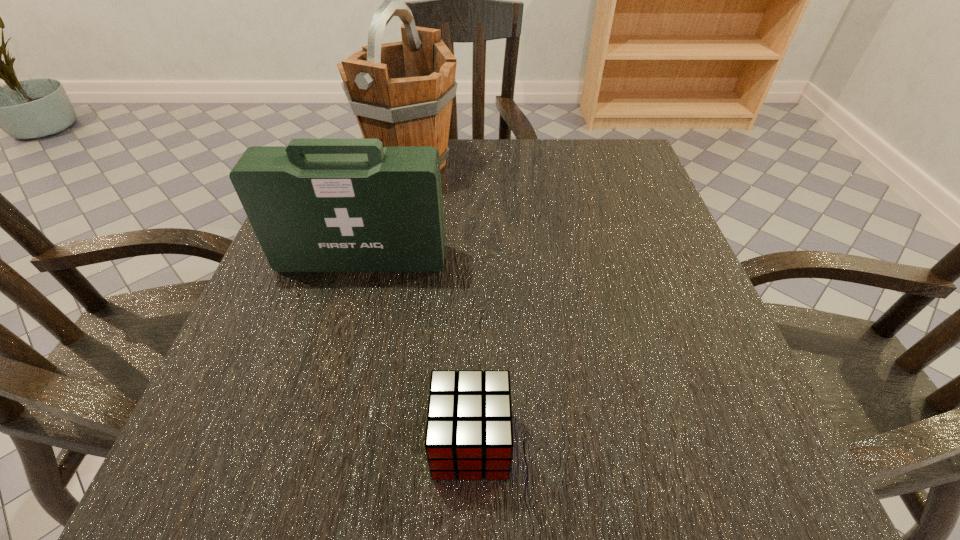
The width and height of the screenshot is (960, 540). Identify the location of free space between the farthest object and the nearest object. (441, 303).

Locate an element on the screen. The height and width of the screenshot is (540, 960). free space between the bucket and the shortest object is located at coordinates (441, 303).

This screenshot has width=960, height=540. Identify the location of free space between the bucket and the cube. (441, 303).

Locate an element on the screen. The height and width of the screenshot is (540, 960). free space between the nearest object and the bucket is located at coordinates (441, 303).

Identify the location of free point between the nearest object and the second tallest object. (417, 350).

You are a GUI agent. You are given a task and a screenshot of the screen. Output one action in this format:
    pyautogui.click(x=<x>, y=<y>)
    Task: Click on the vacant area between the cube and the bucket
    The height and width of the screenshot is (540, 960).
    Given the screenshot: What is the action you would take?
    pyautogui.click(x=441, y=303)

The image size is (960, 540). I want to click on empty location between the second shortest object and the cube, so click(x=417, y=350).

Locate an element on the screen. The image size is (960, 540). the closest object to the second farthest object is located at coordinates (401, 93).

Where is `object that stands as the second closest to the shortest object`? Image resolution: width=960 pixels, height=540 pixels. object that stands as the second closest to the shortest object is located at coordinates (401, 93).

In order to click on vacant region that satisfies the following two spatial constraints: 1. on the front-facing side of the first-aid kit; 2. on the left side of the nearest object in this screenshot , I will do `click(313, 442)`.